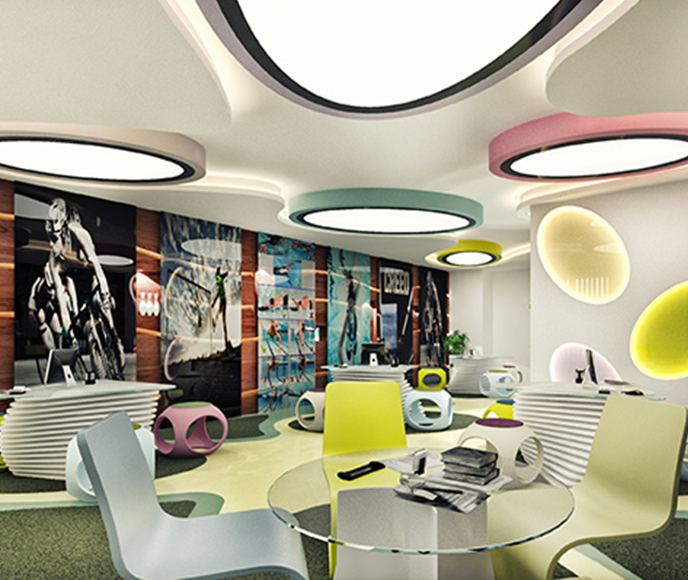
The image size is (688, 580). I want to click on wall between art, so click(x=1, y=290), click(x=148, y=333), click(x=243, y=318), click(x=316, y=304), click(x=375, y=300), click(x=416, y=307), click(x=449, y=307).